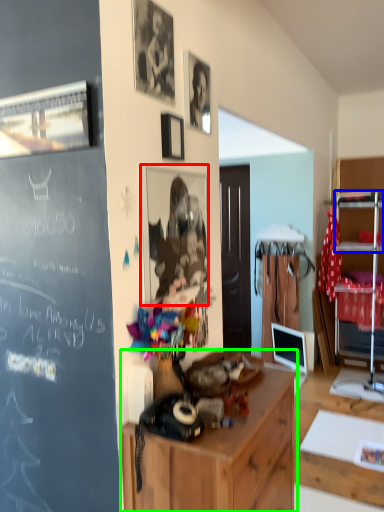
Question: Based on their relative distances, which object is farther from picture frame (highlighted by a red box)? Choose from shelf (highlighted by a blue box) and cabinetry (highlighted by a green box).

Choices:
 (A) shelf
 (B) cabinetry

Answer: (A)